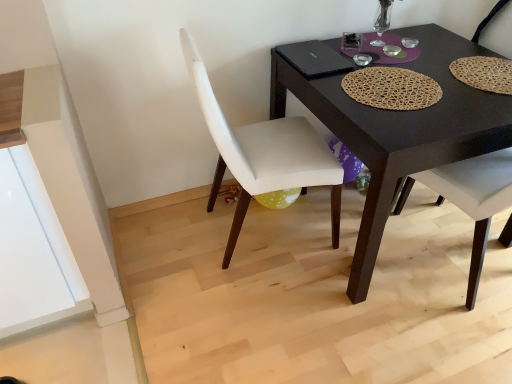
This screenshot has height=384, width=512. Find the location of `vacant space that's between black matte desk at center and white leather chair at center, the second chair positioned from the right`. vacant space that's between black matte desk at center and white leather chair at center, the second chair positioned from the right is located at coordinates (288, 275).